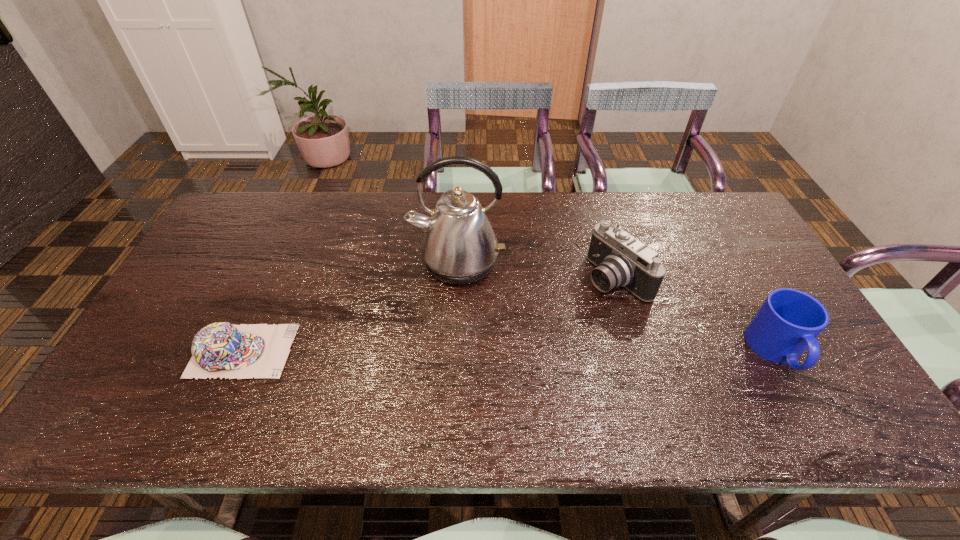
Where is `free region at the near edge`? The width and height of the screenshot is (960, 540). free region at the near edge is located at coordinates (294, 371).

This screenshot has height=540, width=960. In the image, there is a desktop. What are the coordinates of `vacant space at the left edge` in the screenshot? It's located at (231, 262).

The image size is (960, 540). Identify the location of vacant area at the far right corner of the desktop. (705, 222).

Identify the location of empty location between the rightmost object and the tallest object. This screenshot has width=960, height=540. (617, 307).

Identify the location of free space between the third object from left to right and the second object from left to right. pyautogui.click(x=537, y=270).

This screenshot has height=540, width=960. I want to click on free space between the mug and the kettle, so click(617, 307).

Find the location of `vacant point located between the tallest object and the second object from right to left`. vacant point located between the tallest object and the second object from right to left is located at coordinates (537, 270).

Locate an element on the screen. The image size is (960, 540). free spot between the third object from left to right and the leftmost object is located at coordinates (429, 314).

At what (x,y) coordinates should I click in order to perform the action: click on free space between the third object from right to left and the third object from left to right. Please return your answer as a coordinate pair (x, y). Looking at the image, I should click on (537, 270).

Find the location of a particular element. The height and width of the screenshot is (540, 960). free point between the rightmost object and the tallest object is located at coordinates (617, 307).